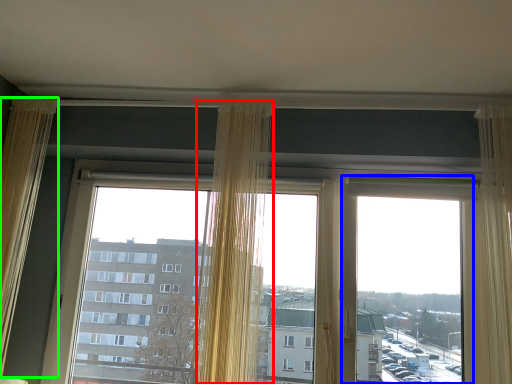
Question: Considering the real-world distances, which object is closest to curtain (highlighted by a red box)? window screen (highlighted by a blue box) or curtain (highlighted by a green box).

Choices:
 (A) window screen
 (B) curtain

Answer: (A)